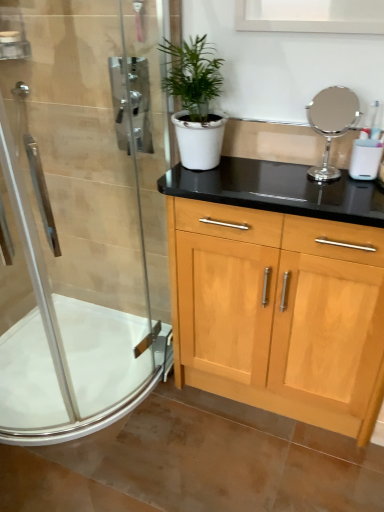
This screenshot has height=512, width=384. Identify the location of free point to the right of clear glass shower door at left. (213, 414).